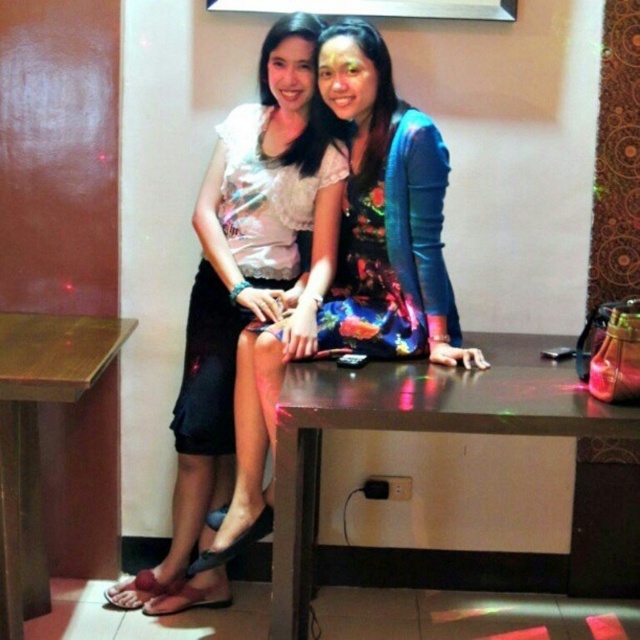
In the scene shown: Is metallic brown table at center above floral satin dress at center?

No.

Is metallic brown table at center thinner than floral satin dress at center?

No.

Locate an element on the screen. This screenshot has width=640, height=640. metallic brown table at center is located at coordinates (412, 429).

Does white lace blouse at upper center appear on the right side of floral satin dress at center?

No, white lace blouse at upper center is not to the right of floral satin dress at center.

Who is shorter, white lace blouse at upper center or floral satin dress at center?

Standing shorter between the two is floral satin dress at center.

Image resolution: width=640 pixels, height=640 pixels. What do you see at coordinates (241, 291) in the screenshot?
I see `white lace blouse at upper center` at bounding box center [241, 291].

The width and height of the screenshot is (640, 640). Find the location of `white lace blouse at upper center`. white lace blouse at upper center is located at coordinates (241, 291).

Measure the distance between floral satin dress at center and wooden table at lower left.

20.81 inches

Can you confirm if floral satin dress at center is smaller than wooden table at lower left?

Indeed, floral satin dress at center has a smaller size compared to wooden table at lower left.

Find the location of a particular element. floral satin dress at center is located at coordinates (268, 200).

This screenshot has height=640, width=640. Find the location of `floral satin dress at center`. floral satin dress at center is located at coordinates (268, 200).